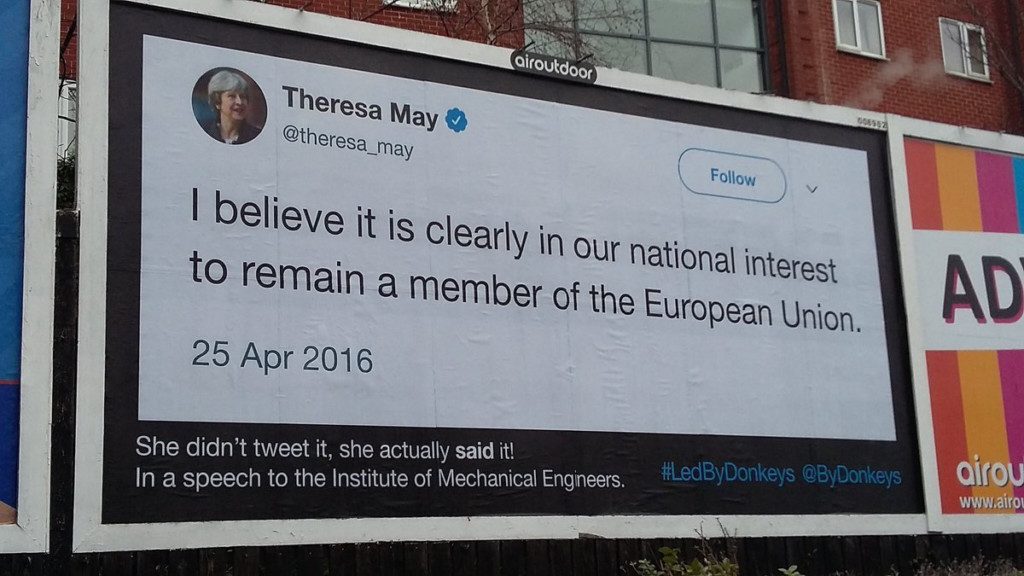
In order to click on rightmost window in this screenshot , I will do `click(969, 49)`.